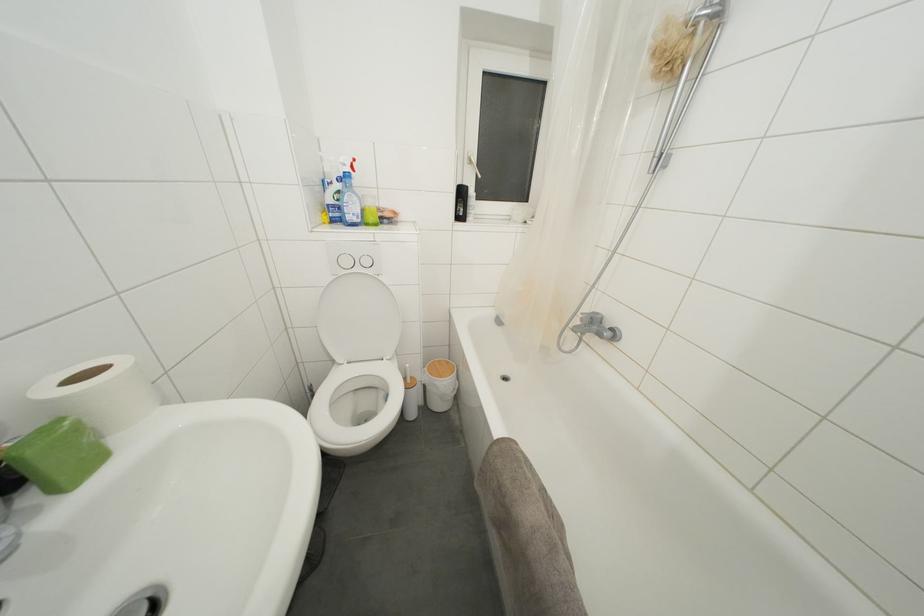
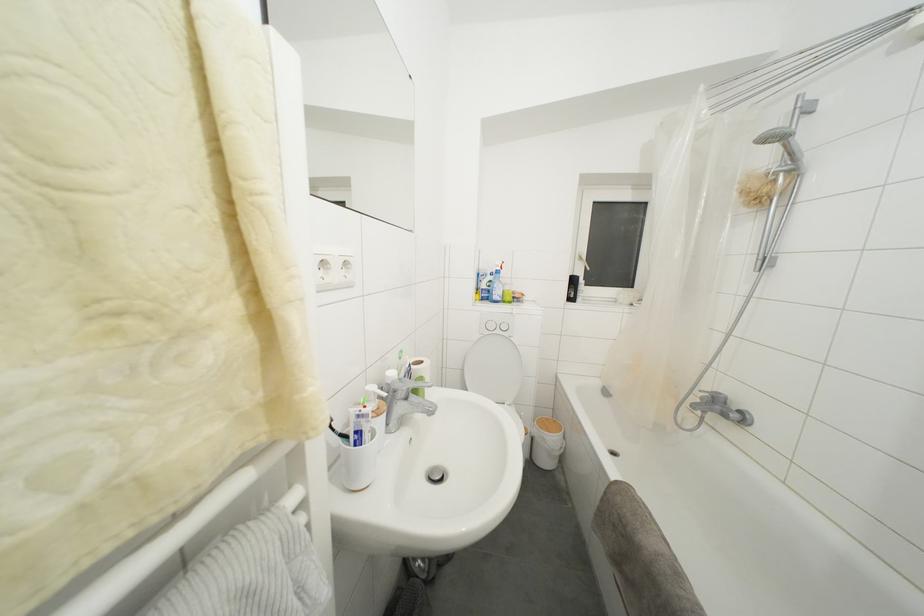
Locate, in the second image, the point that corresponds to point 466,198 in the first image.

(578, 286)